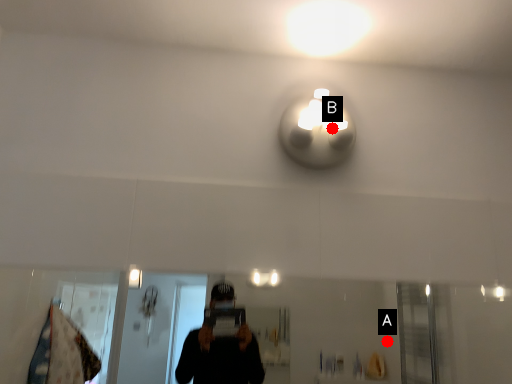
Question: Two points are circled on the image, labeled by A and B beside each circle. Which of the following is the farthest from the observer?

Choices:
 (A) A is further
 (B) B is further

Answer: (A)